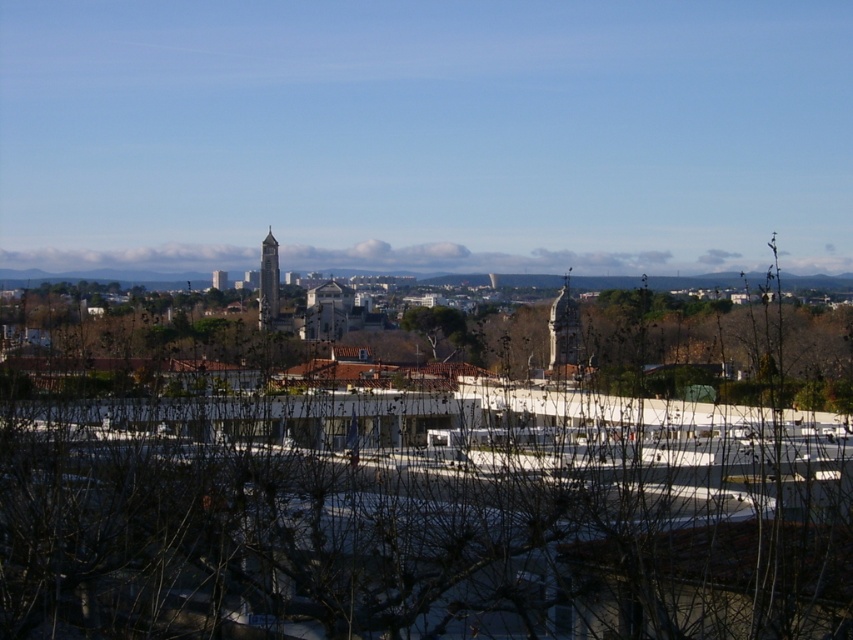
Question: Which object is closer to the camera taking this photo?

Choices:
 (A) smooth gray clock tower at center
 (B) smooth stone tower at center

Answer: (B)

Question: Does smooth stone tower at center have a smaller size compared to smooth gray clock tower at center?

Choices:
 (A) yes
 (B) no

Answer: (B)

Question: Is brown leafless tree at center positioned in front of smooth gray clock tower at center?

Choices:
 (A) no
 (B) yes

Answer: (B)

Question: Which is farther from the brown leafless tree at center?

Choices:
 (A) smooth gray clock tower at center
 (B) smooth stone tower at center

Answer: (A)

Question: Observing the image, what is the correct spatial positioning of brown leafless tree at center in reference to smooth gray clock tower at center?

Choices:
 (A) above
 (B) below

Answer: (B)

Question: Among these objects, which one is nearest to the camera?

Choices:
 (A) brown leafless tree at center
 (B) smooth stone tower at center

Answer: (A)